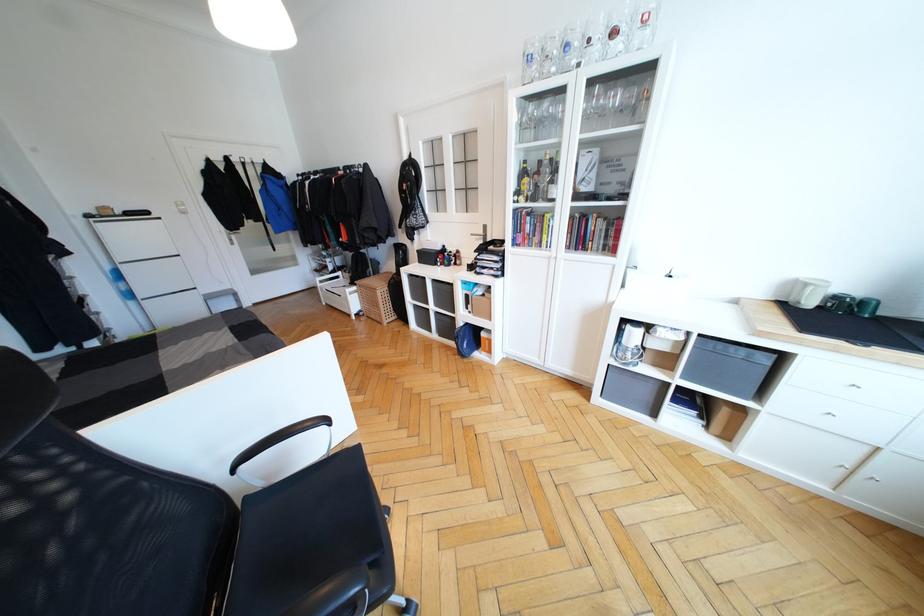
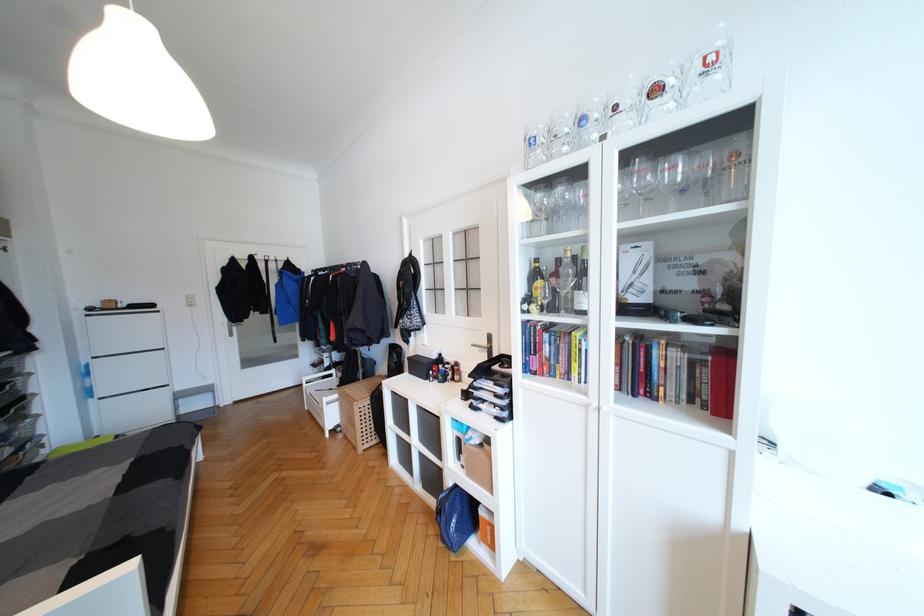
In the second image, find the point that corresponds to the point at 594,84 in the first image.

(631, 156)